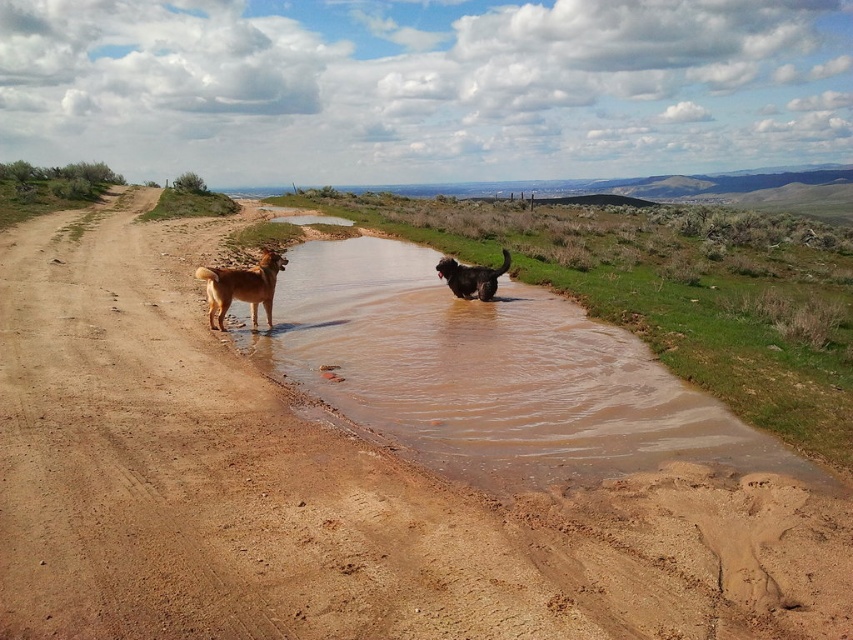
Does point (357, 588) come farther from viewer compared to point (212, 310)?

No, it is in front of (212, 310).

Which is above, brown sandy dirt at center or brown furry dog at left?

brown furry dog at left is above.

Describe the element at coordinates (326, 492) in the screenshot. I see `brown sandy dirt at center` at that location.

The height and width of the screenshot is (640, 853). Find the location of `brown sandy dirt at center`. brown sandy dirt at center is located at coordinates (326, 492).

Is brown sandy dirt at center further to the viewer compared to brown muddy water at center?

No, it is in front of brown muddy water at center.

Between brown sandy dirt at center and brown muddy water at center, which one is positioned lower?

brown sandy dirt at center is below.

Is point (727, 557) farther from viewer compared to point (544, 426)?

No, (727, 557) is in front of (544, 426).

Find the location of `brown sandy dirt at center`. brown sandy dirt at center is located at coordinates (326, 492).

Is point (271, 250) behind point (469, 268)?

Yes, it is behind point (469, 268).

Does brown furry dog at left appear under shiny black fur at center?

Yes, brown furry dog at left is below shiny black fur at center.

Between point (225, 285) and point (448, 272), which one is positioned behind?

The point (448, 272) is behind.

Find the location of a particular element. brown furry dog at left is located at coordinates (241, 288).